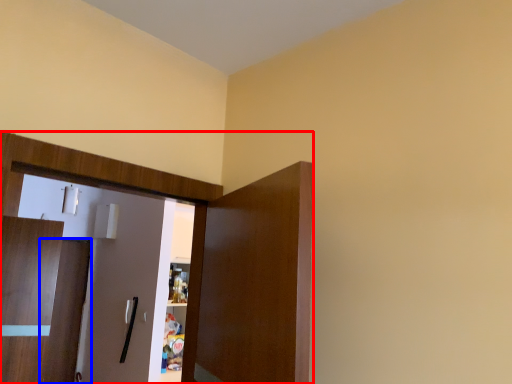
Question: Which object is further to the camera taking this photo, dresser (highlighted by a red box) or door (highlighted by a blue box)?

Choices:
 (A) dresser
 (B) door

Answer: (B)